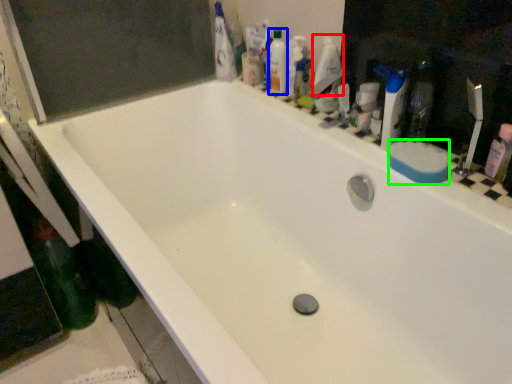
Question: Estimate the real-world distances between objects in this image. Which object is farther from cleaning product (highlighted by a red box), mouthwash (highlighted by a blue box) or soap (highlighted by a green box)?

Choices:
 (A) mouthwash
 (B) soap

Answer: (B)